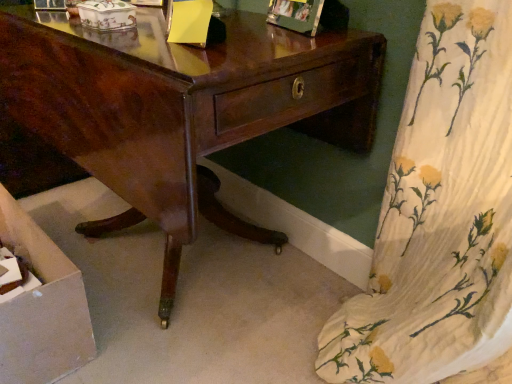
This screenshot has width=512, height=384. Identify the location of glossy wood desk at center. (181, 109).

This screenshot has width=512, height=384. Describe the element at coordinates (181, 109) in the screenshot. I see `glossy wood desk at center` at that location.

In order to click on glossy wood desk at center in this screenshot , I will do `click(181, 109)`.